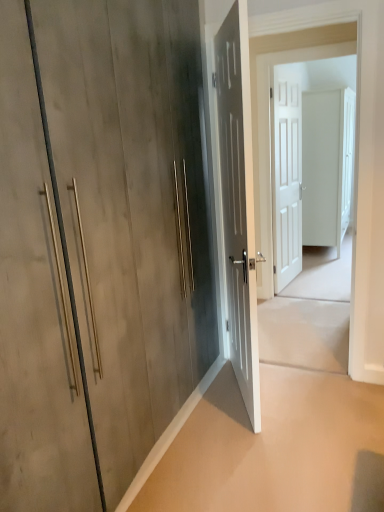
Question: Are beige concrete at lower right and matte wood door at center, arranged as the fourth door when viewed from the right, far apart?

Choices:
 (A) no
 (B) yes

Answer: (A)

Question: Considering the relative positions of beige concrete at lower right and matte wood door at center, which is the 4th door from back to front, in the image provided, is beige concrete at lower right in front of matte wood door at center, which is the 4th door from back to front,?

Choices:
 (A) yes
 (B) no

Answer: (B)

Question: Considering the relative positions of beige concrete at lower right and matte wood door at center, which is the 4th door from back to front, in the image provided, is beige concrete at lower right to the left of matte wood door at center, which is the 4th door from back to front, from the viewer's perspective?

Choices:
 (A) yes
 (B) no

Answer: (B)

Question: Is beige concrete at lower right smaller than matte wood door at center, the first door positioned from the left?

Choices:
 (A) no
 (B) yes

Answer: (B)

Question: Considering the relative sizes of beige concrete at lower right and matte wood door at center, which is counted as the first door, starting from the front, in the image provided, is beige concrete at lower right bigger than matte wood door at center, which is counted as the first door, starting from the front,?

Choices:
 (A) yes
 (B) no

Answer: (B)

Question: From a real-world perspective, is matte gray door at center, which appears as the 3th door when viewed from the right, physically located above or below white matte door at center?

Choices:
 (A) above
 (B) below

Answer: (B)

Question: Is matte gray door at center, which appears as the 2th door when viewed from the left, wider or thinner than white matte door at center?

Choices:
 (A) wide
 (B) thin

Answer: (A)

Question: Is matte gray door at center, positioned as the 3th door in back-to-front order, situated inside white matte door at center or outside?

Choices:
 (A) inside
 (B) outside

Answer: (B)

Question: From their relative heights in the image, would you say matte gray door at center, which appears as the 2th door when viewed from the left, is taller or shorter than white matte door at center?

Choices:
 (A) short
 (B) tall

Answer: (A)

Question: From the image's perspective, relative to white matte door at center, marked as the first door in a back-to-front arrangement, is matte wood door at center, arranged as the fourth door when viewed from the right, above or below?

Choices:
 (A) below
 (B) above

Answer: (A)

Question: Is matte wood door at center, the first door positioned from the left, in front of or behind white matte door at center, marked as the first door in a back-to-front arrangement, in the image?

Choices:
 (A) front
 (B) behind

Answer: (A)

Question: From a real-world perspective, relative to white matte door at center, which ranks as the 1th door in right-to-left order, is matte wood door at center, which is the 4th door from back to front, vertically above or below?

Choices:
 (A) below
 (B) above

Answer: (B)

Question: In terms of height, does matte wood door at center, the first door positioned from the left, look taller or shorter compared to white matte door at center, which ranks as the 1th door in right-to-left order?

Choices:
 (A) short
 (B) tall

Answer: (B)

Question: In terms of height, does beige concrete at lower right look taller or shorter compared to white matte door at center, the 3th door when ordered from front to back?

Choices:
 (A) tall
 (B) short

Answer: (B)

Question: From the image's perspective, is beige concrete at lower right located above or below white matte door at center, the 2th door positioned from the right?

Choices:
 (A) below
 (B) above

Answer: (A)